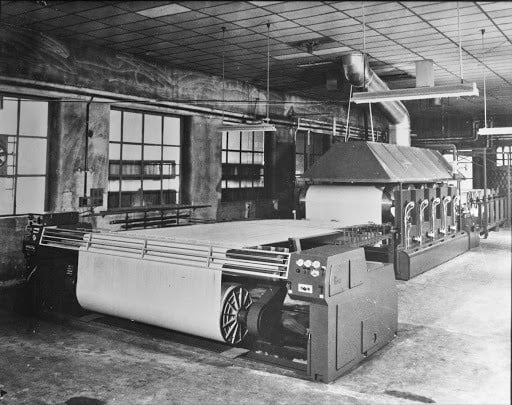
Find the location of a particular element. floor is located at coordinates (110, 360), (402, 375), (468, 310), (501, 238).